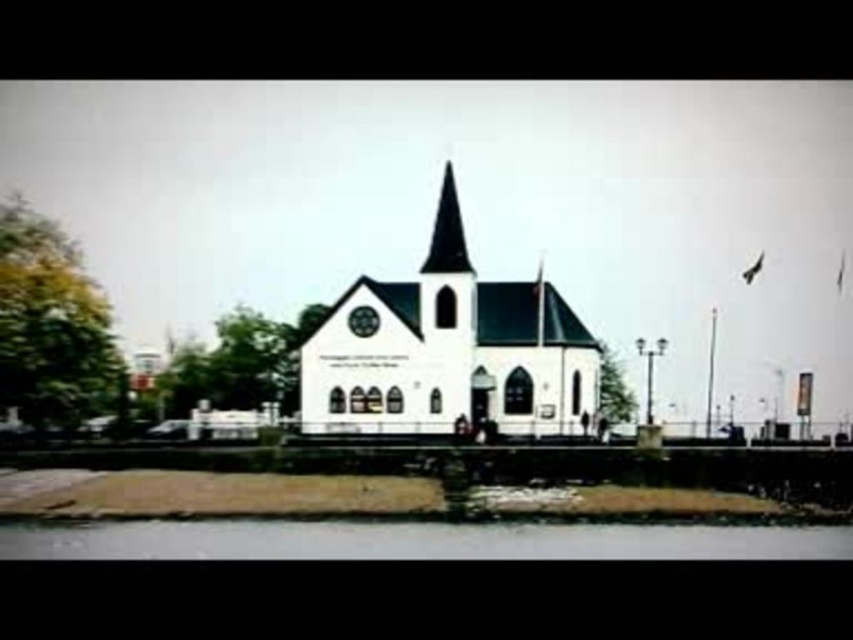
Question: Is white matte church at center in front of clear water at lower center?

Choices:
 (A) no
 (B) yes

Answer: (A)

Question: Which point appears closest to the camera in this image?

Choices:
 (A) [x=16, y=556]
 (B) [x=431, y=308]

Answer: (A)

Question: Considering the relative positions of white matte church at center and clear water at lower center in the image provided, where is white matte church at center located with respect to clear water at lower center?

Choices:
 (A) below
 (B) above

Answer: (B)

Question: Observing the image, what is the correct spatial positioning of white matte church at center in reference to clear water at lower center?

Choices:
 (A) below
 (B) above

Answer: (B)

Question: Which object appears farthest from the camera in this image?

Choices:
 (A) white matte church at center
 (B) black glass spire at center

Answer: (B)

Question: Which point is closer to the camera?

Choices:
 (A) black glass spire at center
 (B) white matte church at center
 (C) clear water at lower center

Answer: (C)